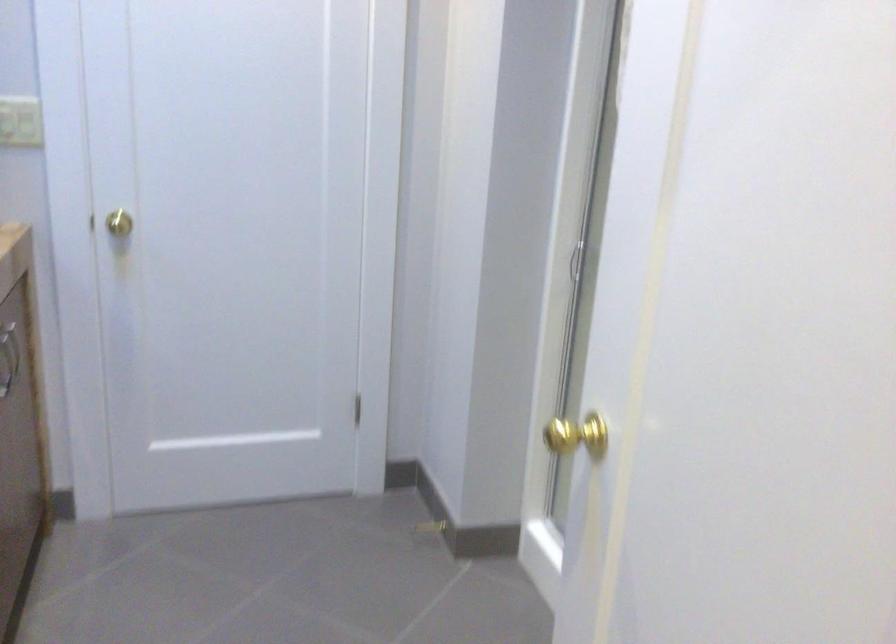
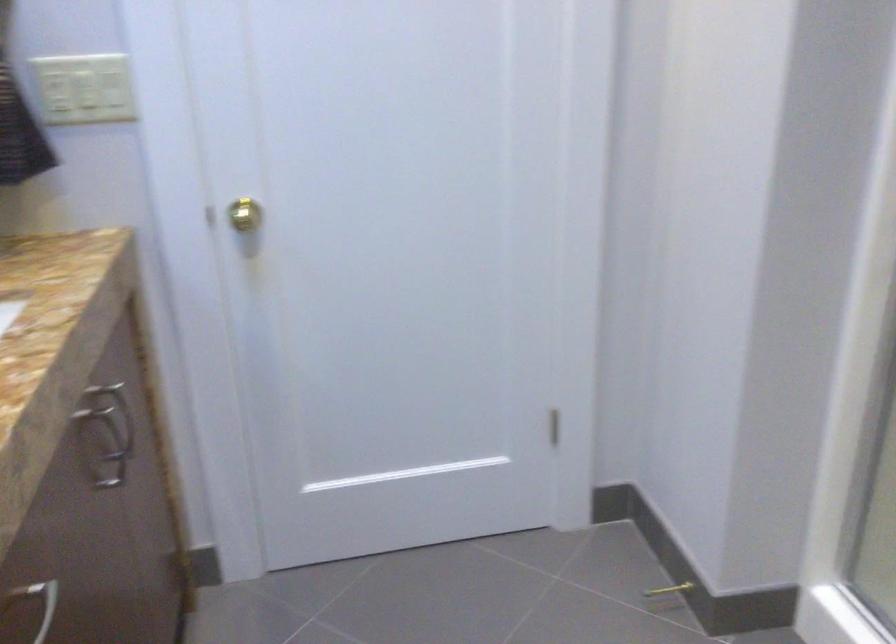
In the second image, find the point that corresponds to point (116, 219) in the first image.

(240, 214)